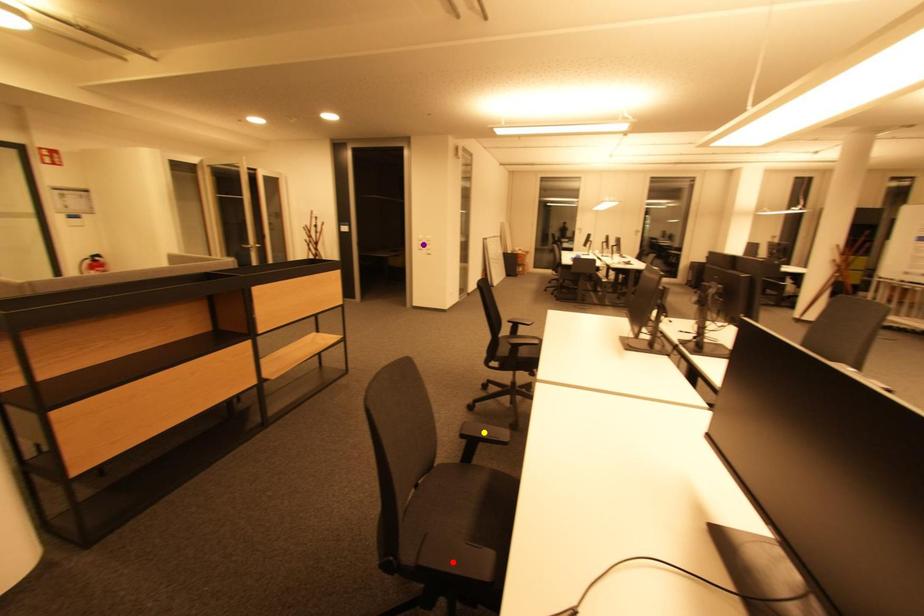
Order these from nearest to farthest:
yellow point, red point, purple point

red point < yellow point < purple point